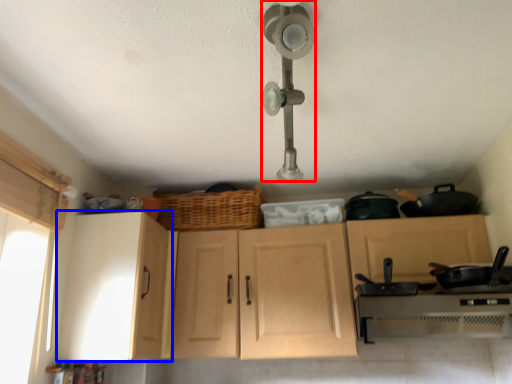
Question: Which point is closer to the camera, light fixture (highlighted by a red box) or cabinetry (highlighted by a blue box)?

Choices:
 (A) light fixture
 (B) cabinetry

Answer: (A)